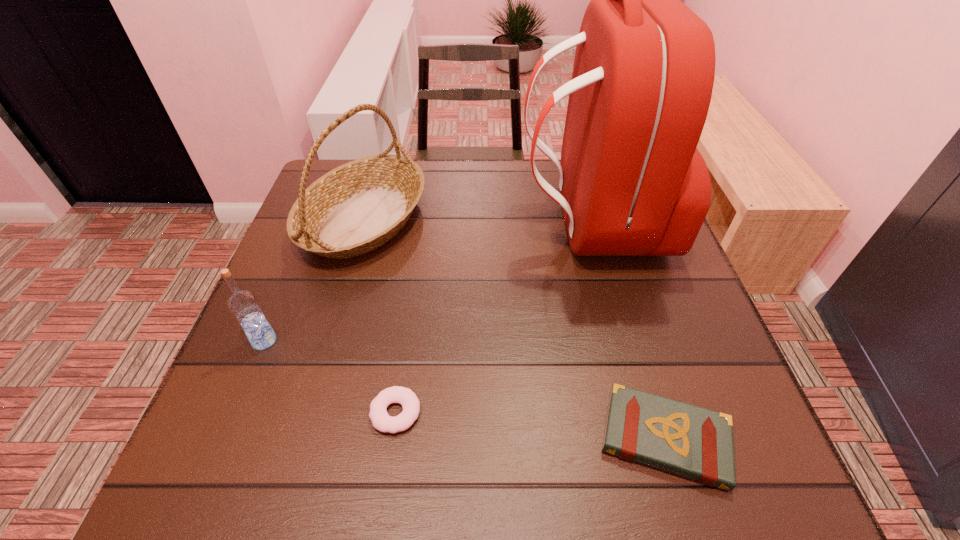
Where is `free space between the book and the tallest object`? This screenshot has width=960, height=540. free space between the book and the tallest object is located at coordinates [628, 331].

Find the location of `free spot between the basket and the backpack`. free spot between the basket and the backpack is located at coordinates (477, 221).

This screenshot has width=960, height=540. I want to click on free space between the fourth tallest object and the third tallest object, so (x=465, y=389).

The width and height of the screenshot is (960, 540). What are the coordinates of `free space between the third nearest object and the backpack` in the screenshot? It's located at (427, 282).

The height and width of the screenshot is (540, 960). In order to click on free area in between the third nearest object and the second shortest object in this screenshot , I will do `click(465, 389)`.

Find the location of a particular element. The width and height of the screenshot is (960, 540). vacant space that is in between the tallest object and the second tallest object is located at coordinates (477, 221).

Where is `vacant point located between the backpack and the third tallest object`? This screenshot has height=540, width=960. vacant point located between the backpack and the third tallest object is located at coordinates (427, 282).

You are a GUI agent. You are given a task and a screenshot of the screen. Output one action in this format:
    pyautogui.click(x=<x>, y=<y>)
    Task: Click on the free space that is in between the basket and the doughnut
    This screenshot has width=960, height=540.
    Given the screenshot: What is the action you would take?
    pyautogui.click(x=380, y=315)

Find the location of a particular element. free space between the basket and the tallest object is located at coordinates (477, 221).

Select which object is the second closest to the basket. Please provide its 2D coordinates. Your answer should be formatted as a tuple, i.e. [(x, y)], where the tuple contains the x and y coordinates of a point satisfying the conditions above.

[(632, 183)]